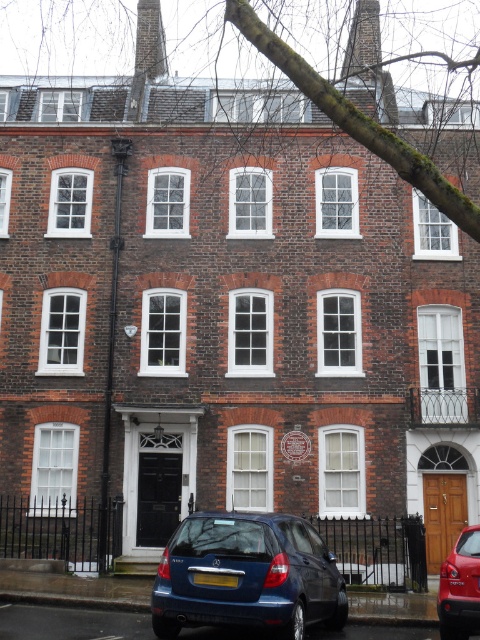
Question: Does glossy metallic hatchback at lower center appear on the right side of metallic blue hatchback at center?

Choices:
 (A) yes
 (B) no

Answer: (B)

Question: Is glossy metallic hatchback at lower center below metallic blue hatchback at center?

Choices:
 (A) yes
 (B) no

Answer: (A)

Question: Which point is closer to the camera taking this photo?

Choices:
 (A) (256, 609)
 (B) (450, 577)

Answer: (A)

Question: Among these points, which one is nearest to the camera?

Choices:
 (A) (325, 621)
 (B) (453, 637)

Answer: (B)

Question: Does glossy metallic hatchback at lower center have a lesser width compared to metallic blue hatchback at center?

Choices:
 (A) yes
 (B) no

Answer: (B)